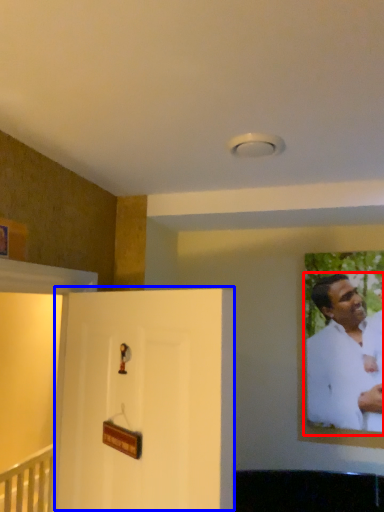
Question: Among these objects, which one is farthest to the camera, man (highlighted by a red box) or door (highlighted by a blue box)?

Choices:
 (A) man
 (B) door

Answer: (A)